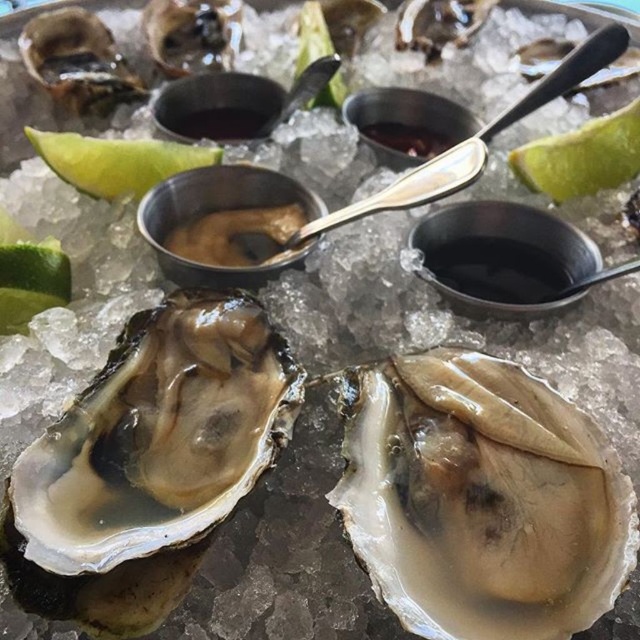
You are a food critic who wants to taste the shiny pearl oyster at center and the shiny brown oyster at upper left. Which oyster would you reach for first if you are sitting directly in front of the plate?

You would reach for the shiny pearl oyster at center first because it is positioned in front of the shiny brown oyster at upper left, making it closer to your hand.

You are a food critic trying to place a lime wedge into your oyster. Based on the image, which object is wider, the shiny pearl oyster at center or the green matte lime at upper right?

The shiny pearl oyster at center might be wider than green matte lime at upper right according to the description.

You are standing in front of a plate of oysters on ice with condiment bowls nearby. You want to reach for the point at coordinate point [497,550]. Is this point within your arm reach?

The distance between point [497,550] and the viewer is 33.47 inches, so yes, the point is within arm reach as it is close enough for a person to comfortably reach.